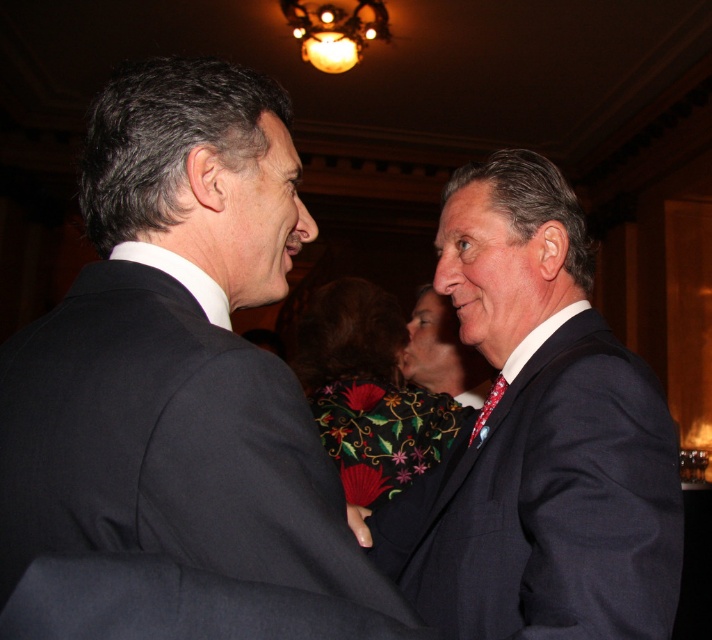
You are a photographer at this event and want to capture a clear shot of both the black matte suit at center and the embroidered silk vest at center. Since the camera can only focus on one subject at a time, which one should you choose to ensure the other remains somewhat in focus?

The black matte suit at center is closer to the viewer than the embroidered silk vest at center, so focusing on the closer object will keep the farther one in better focus. Therefore, you should focus on the black matte suit at center to ensure the embroidered silk vest at center remains somewhat in focus.

From the picture: You are a photographer at the event and want to capture a clear photo of both the embroidered silk vest at center and the patterned silk tie at right. Which object should you adjust your focus to ensure it appears sharp in the photo?

The embroidered silk vest at center should be the focus point since the patterned silk tie at right is behind it, making the vest closer to the camera and thus in focus first.

Looking at this image, you are a fashion designer observing the scene and want to know the spatial relationship between the embroidered silk vest at center and the patterned silk tie at right. Which one is positioned lower in the image?

The embroidered silk vest at center is located below the patterned silk tie at right, so it is positioned lower in the image.